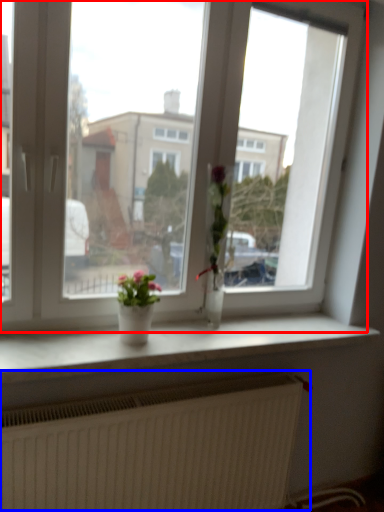
Question: Which object appears closest to the camera in this image, window (highlighted by a red box) or radiator (highlighted by a blue box)?

Choices:
 (A) window
 (B) radiator

Answer: (A)